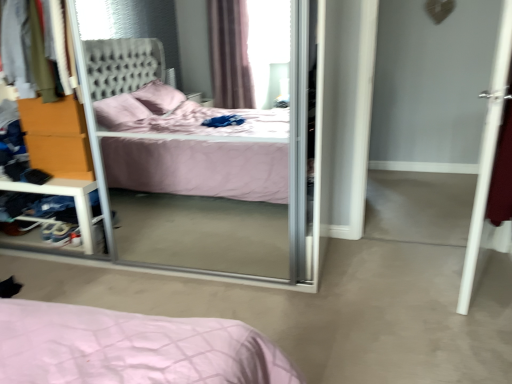
Question: Is transparent glass screen door at center at the right side of clear plastic shelf at left?

Choices:
 (A) no
 (B) yes

Answer: (B)

Question: Is transparent glass screen door at center outside of clear plastic shelf at left?

Choices:
 (A) yes
 (B) no

Answer: (A)

Question: Is transparent glass screen door at center bigger than clear plastic shelf at left?

Choices:
 (A) no
 (B) yes

Answer: (B)

Question: Is transparent glass screen door at center closer to camera compared to clear plastic shelf at left?

Choices:
 (A) yes
 (B) no

Answer: (A)

Question: Is transparent glass screen door at center positioned with its back to clear plastic shelf at left?

Choices:
 (A) yes
 (B) no

Answer: (A)

Question: Is transparent glass screen door at center shorter than clear plastic shelf at left?

Choices:
 (A) yes
 (B) no

Answer: (B)

Question: Can you confirm if velvet fabric sweater at upper left is wider than transparent glass screen door at center?

Choices:
 (A) yes
 (B) no

Answer: (B)

Question: Considering the relative positions of velvet fabric sweater at upper left and transparent glass screen door at center in the image provided, is velvet fabric sweater at upper left to the left of transparent glass screen door at center from the viewer's perspective?

Choices:
 (A) no
 (B) yes

Answer: (B)

Question: Is velvet fabric sweater at upper left taller than transparent glass screen door at center?

Choices:
 (A) no
 (B) yes

Answer: (A)

Question: Does velvet fabric sweater at upper left lie behind transparent glass screen door at center?

Choices:
 (A) yes
 (B) no

Answer: (A)

Question: Can you confirm if velvet fabric sweater at upper left is shorter than transparent glass screen door at center?

Choices:
 (A) no
 (B) yes

Answer: (B)

Question: From the image's perspective, is velvet fabric sweater at upper left beneath transparent glass screen door at center?

Choices:
 (A) no
 (B) yes

Answer: (A)

Question: Does velvet fabric sweater at upper left appear on the left side of white smooth door at right?

Choices:
 (A) yes
 (B) no

Answer: (A)